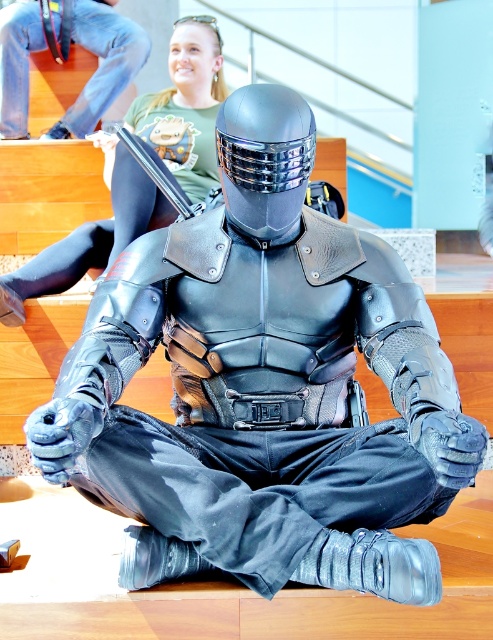
Question: Can you confirm if green t-shirt at upper center is positioned above matte black armor at center?

Choices:
 (A) yes
 (B) no

Answer: (B)

Question: Which point is closer to the camera taking this photo?

Choices:
 (A) (131, 228)
 (B) (32, 22)

Answer: (A)

Question: Which point is farther to the camera?

Choices:
 (A) matte black armor at center
 (B) green t-shirt at upper center

Answer: (A)

Question: Does green t-shirt at upper center have a smaller size compared to matte black armor at center?

Choices:
 (A) no
 (B) yes

Answer: (A)

Question: Among these objects, which one is nearest to the camera?

Choices:
 (A) green t-shirt at upper center
 (B) matte black armor at center

Answer: (A)

Question: Is green t-shirt at upper center further to camera compared to matte black armor at center?

Choices:
 (A) yes
 (B) no

Answer: (B)